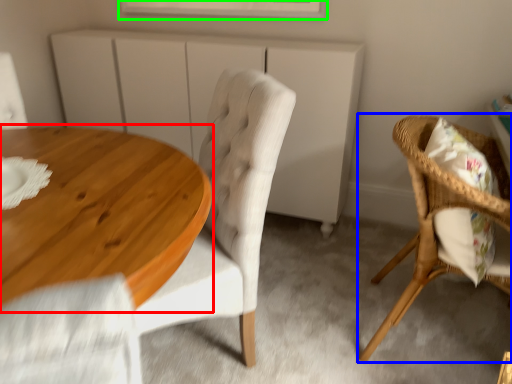
Question: Estimate the real-world distances between objects in this image. Which object is farther from coffee table (highlighted by a red box), chair (highlighted by a blue box) or window (highlighted by a green box)?

Choices:
 (A) chair
 (B) window

Answer: (B)